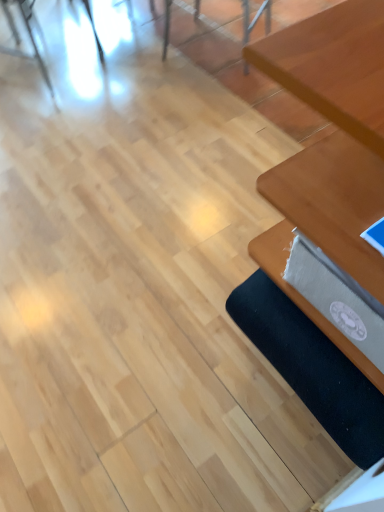
Locate an element on the screen. The width and height of the screenshot is (384, 512). vacant space in front of wooden chair at upper center, which is counted as the 2th chair, starting from the left is located at coordinates (217, 97).